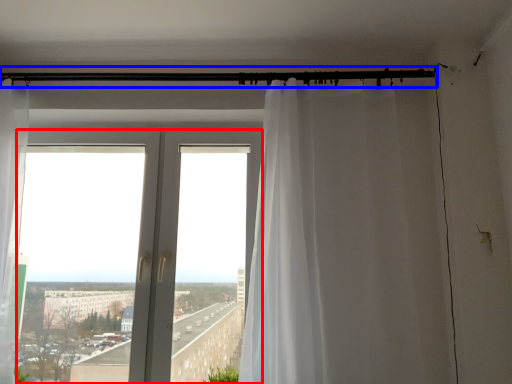
Question: Which object appears farthest to the camera in this image, window (highlighted by a red box) or beam (highlighted by a blue box)?

Choices:
 (A) window
 (B) beam

Answer: (B)